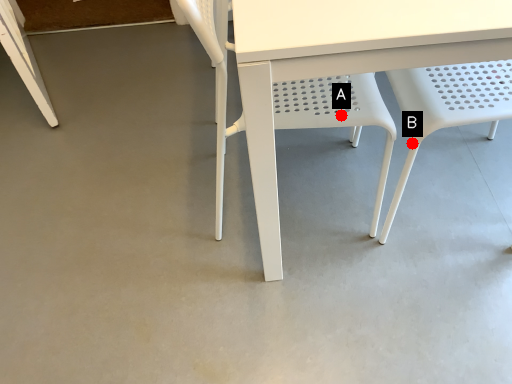
Question: Two points are circled on the image, labeled by A and B beside each circle. Among these points, which one is nearest to the camera?

Choices:
 (A) A is closer
 (B) B is closer

Answer: (B)